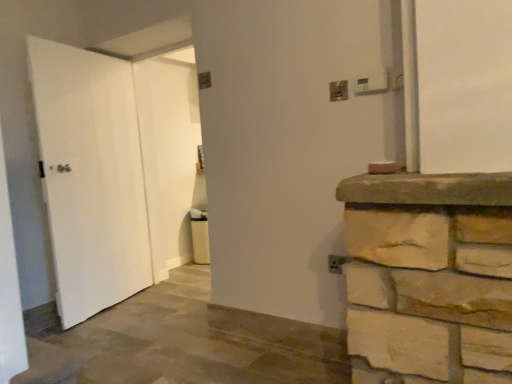
What do you see at coordinates (338, 90) in the screenshot?
I see `metallic silver electric outlet at upper center, which is counted as the second electric outlet, starting from the right` at bounding box center [338, 90].

Describe the element at coordinates (115, 170) in the screenshot. Image resolution: width=512 pixels, height=384 pixels. I see `white matte door at left, which is the 2th door from right to left` at that location.

At what (x,y) coordinates should I click in order to perform the action: click on metallic silver electric outlet at upper right, positioned as the first electric outlet in front-to-back order. Please return your answer as a coordinate pair (x, y). Looking at the image, I should click on (372, 83).

You are a GUI agent. You are given a task and a screenshot of the screen. Output one action in this format:
    pyautogui.click(x=<x>, y=<y>)
    Task: Click on the metallic silver electric outlet at upper center, which is counted as the second electric outlet, starting from the front
    The height and width of the screenshot is (384, 512).
    Given the screenshot: What is the action you would take?
    click(338, 90)

Find the location of a particular element. This screenshot has width=512, height=384. the 2nd door counting from the left of the metallic silver electric outlet at upper right, the second electric outlet when ordered from back to front is located at coordinates (115, 170).

Can you tell me how much metallic silver electric outlet at upper right, the 1th electric outlet viewed from the right, and white matte door at left, which is the 2th door from right to left, differ in facing direction?

101 degrees separate the facing orientations of metallic silver electric outlet at upper right, the 1th electric outlet viewed from the right, and white matte door at left, which is the 2th door from right to left.

From a real-world perspective, is metallic silver electric outlet at upper right, the second electric outlet when ordered from back to front, positioned above or below white matte door at left, which is the 2th door from right to left?

metallic silver electric outlet at upper right, the second electric outlet when ordered from back to front, is situated higher than white matte door at left, which is the 2th door from right to left, in the real world.

Considering the positions of objects white matte door at left, positioned as the 1th door in left-to-right order, and metallic silver electric outlet at upper right, the second electric outlet when ordered from back to front, in the image provided, who is more to the right, white matte door at left, positioned as the 1th door in left-to-right order, or metallic silver electric outlet at upper right, the second electric outlet when ordered from back to front,?

From the viewer's perspective, metallic silver electric outlet at upper right, the second electric outlet when ordered from back to front, appears more on the right side.

Locate an element on the screen. The height and width of the screenshot is (384, 512). the 1st door behind the metallic silver electric outlet at upper right, the 1th electric outlet viewed from the right, starting your count from the anchor is located at coordinates (115, 170).

Based on the photo, is white matte door at left, which is the 2th door from right to left, facing towards metallic silver electric outlet at upper right, the second electric outlet when ordered from back to front?

Yes.

Is white matte door at left, positioned as the 1th door in left-to-right order, taller than metallic silver electric outlet at upper right, positioned as the first electric outlet in front-to-back order?

Yes.

From a real-world perspective, which object rests below the other?

white matte door at left, positioned as the 1th door in left-to-right order, is physically lower.

Is white matte door at center, positioned as the second door in left-to-right order, oriented away from white matte door at left, positioned as the 1th door in left-to-right order?

Yes, white matte door at center, positioned as the second door in left-to-right order, is facing away from white matte door at left, positioned as the 1th door in left-to-right order.

From the image's perspective, is white matte door at center, positioned as the second door in left-to-right order, positioned above or below white matte door at left, which is the 2th door from right to left?

white matte door at center, positioned as the second door in left-to-right order, is above white matte door at left, which is the 2th door from right to left.

Which is more to the left, white matte door at center, the 1th door positioned from the right, or white matte door at left, positioned as the 1th door in left-to-right order?

Positioned to the left is white matte door at left, positioned as the 1th door in left-to-right order.

Find the location of `the 1st door counting from the left of the metallic silver electric outlet at upper center, which is counted as the second electric outlet, starting from the front`. the 1st door counting from the left of the metallic silver electric outlet at upper center, which is counted as the second electric outlet, starting from the front is located at coordinates (169, 157).

Based on the photo, is metallic silver electric outlet at upper center, which is counted as the second electric outlet, starting from the front, taller than white matte door at center, positioned as the second door in left-to-right order?

No, metallic silver electric outlet at upper center, which is counted as the second electric outlet, starting from the front, is not taller than white matte door at center, positioned as the second door in left-to-right order.

Which object is positioned more to the left, metallic silver electric outlet at upper center, which is counted as the second electric outlet, starting from the right, or white matte door at center, the 1th door positioned from the right?

From the viewer's perspective, white matte door at center, the 1th door positioned from the right, appears more on the left side.

Can you confirm if metallic silver electric outlet at upper center, which is counted as the second electric outlet, starting from the right, is bigger than white matte door at center, the 1th door positioned from the right?

Actually, metallic silver electric outlet at upper center, which is counted as the second electric outlet, starting from the right, might be smaller than white matte door at center, the 1th door positioned from the right.

In terms of width, does metallic silver electric outlet at upper right, positioned as the first electric outlet in front-to-back order, look wider or thinner when compared to metallic silver electric outlet at upper center, which is counted as the second electric outlet, starting from the front?

metallic silver electric outlet at upper right, positioned as the first electric outlet in front-to-back order, is wider than metallic silver electric outlet at upper center, which is counted as the second electric outlet, starting from the front.

Between metallic silver electric outlet at upper right, positioned as the first electric outlet in front-to-back order, and metallic silver electric outlet at upper center, which is counted as the 1th electric outlet, starting from the left, which one has larger size?

metallic silver electric outlet at upper right, positioned as the first electric outlet in front-to-back order.

From the image's perspective, is metallic silver electric outlet at upper right, the second electric outlet when ordered from back to front, beneath metallic silver electric outlet at upper center, which is counted as the 1th electric outlet, starting from the left?

No, from the image's perspective, metallic silver electric outlet at upper right, the second electric outlet when ordered from back to front, is not below metallic silver electric outlet at upper center, which is counted as the 1th electric outlet, starting from the left.

Is the position of white matte door at left, positioned as the 1th door in left-to-right order, less distant than that of metallic silver electric outlet at upper center, the first electric outlet from the back?

No, white matte door at left, positioned as the 1th door in left-to-right order, is further to the viewer.

Between white matte door at left, which is the 2th door from right to left, and metallic silver electric outlet at upper center, the first electric outlet from the back, which one has larger size?

white matte door at left, which is the 2th door from right to left.

Is point (169, 144) closer or farther from the camera than point (343, 100)?

Point (169, 144) is positioned farther from the camera compared to point (343, 100).

Which of these two, metallic silver electric outlet at upper right, the second electric outlet when ordered from back to front, or white matte door at center, positioned as the second door in left-to-right order, stands taller?

With more height is white matte door at center, positioned as the second door in left-to-right order.

Between metallic silver electric outlet at upper right, positioned as the first electric outlet in front-to-back order, and white matte door at center, the 1th door positioned from the right, which one has smaller width?

With smaller width is metallic silver electric outlet at upper right, positioned as the first electric outlet in front-to-back order.

Measure the distance between metallic silver electric outlet at upper right, acting as the second electric outlet starting from the left, and white matte door at center, positioned as the second door in left-to-right order.

metallic silver electric outlet at upper right, acting as the second electric outlet starting from the left, is 2.46 meters from white matte door at center, positioned as the second door in left-to-right order.

From a real-world perspective, who is located higher, metallic silver electric outlet at upper right, positioned as the first electric outlet in front-to-back order, or white matte door at center, the 1th door positioned from the right?

From a 3D spatial view, metallic silver electric outlet at upper right, positioned as the first electric outlet in front-to-back order, is above.

Where is `door that is the 2nd object directly below the metallic silver electric outlet at upper right, positioned as the first electric outlet in front-to-back order (from a real-world perspective)`? This screenshot has height=384, width=512. door that is the 2nd object directly below the metallic silver electric outlet at upper right, positioned as the first electric outlet in front-to-back order (from a real-world perspective) is located at coordinates (115, 170).

From the image's perspective, count 2nd electric outlets upward from the white matte door at left, positioned as the 1th door in left-to-right order, and point to it. Please provide its 2D coordinates.

[(372, 83)]

Looking at the image, which one is located further to white matte door at center, positioned as the second door in left-to-right order, white matte door at left, positioned as the 1th door in left-to-right order, or metallic silver electric outlet at upper center, which is counted as the second electric outlet, starting from the front?

The object further to white matte door at center, positioned as the second door in left-to-right order, is metallic silver electric outlet at upper center, which is counted as the second electric outlet, starting from the front.

Based on their spatial positions, is white matte door at center, the 1th door positioned from the right, or metallic silver electric outlet at upper center, the first electric outlet from the back, closer to metallic silver electric outlet at upper right, the second electric outlet when ordered from back to front?

metallic silver electric outlet at upper center, the first electric outlet from the back, is closer to metallic silver electric outlet at upper right, the second electric outlet when ordered from back to front.

In the scene shown: When comparing their distances from white matte door at left, which is the 2th door from right to left, does metallic silver electric outlet at upper right, acting as the second electric outlet starting from the left, or metallic silver electric outlet at upper center, which is counted as the 1th electric outlet, starting from the left, seem closer?

Among the two, metallic silver electric outlet at upper center, which is counted as the 1th electric outlet, starting from the left, is located nearer to white matte door at left, which is the 2th door from right to left.

Consider the image. Based on their spatial positions, is white matte door at left, which is the 2th door from right to left, or metallic silver electric outlet at upper right, positioned as the first electric outlet in front-to-back order, closer to white matte door at center, positioned as the second door in left-to-right order?

white matte door at left, which is the 2th door from right to left, is positioned closer to the anchor white matte door at center, positioned as the second door in left-to-right order.

Estimate the real-world distances between objects in this image. Which object is closer to metallic silver electric outlet at upper right, the second electric outlet when ordered from back to front, metallic silver electric outlet at upper center, which is counted as the 1th electric outlet, starting from the left, or white matte door at center, positioned as the second door in left-to-right order?

metallic silver electric outlet at upper center, which is counted as the 1th electric outlet, starting from the left, is closer to metallic silver electric outlet at upper right, the second electric outlet when ordered from back to front.

From the image, which object appears to be farther from metallic silver electric outlet at upper center, which is counted as the second electric outlet, starting from the front, metallic silver electric outlet at upper right, positioned as the first electric outlet in front-to-back order, or white matte door at center, the 1th door positioned from the right?

white matte door at center, the 1th door positioned from the right.

When comparing their distances from white matte door at center, the 1th door positioned from the right, does metallic silver electric outlet at upper right, acting as the second electric outlet starting from the left, or white matte door at left, positioned as the 1th door in left-to-right order, seem closer?

white matte door at left, positioned as the 1th door in left-to-right order, is positioned closer to the anchor white matte door at center, the 1th door positioned from the right.

Based on the photo, when comparing their distances from white matte door at left, positioned as the 1th door in left-to-right order, does metallic silver electric outlet at upper center, which is counted as the second electric outlet, starting from the right, or metallic silver electric outlet at upper right, acting as the second electric outlet starting from the left, seem further?

metallic silver electric outlet at upper right, acting as the second electric outlet starting from the left.

Find the location of a particular element. This screenshot has width=512, height=384. door located between white matte door at left, positioned as the 1th door in left-to-right order, and metallic silver electric outlet at upper center, the first electric outlet from the back, in the left-right direction is located at coordinates (169, 157).

I want to click on electric outlet between white matte door at left, positioned as the 1th door in left-to-right order, and metallic silver electric outlet at upper right, the second electric outlet when ordered from back to front, in the horizontal direction, so click(338, 90).

Locate an element on the screen. This screenshot has height=384, width=512. electric outlet between white matte door at center, the 1th door positioned from the right, and metallic silver electric outlet at upper right, positioned as the first electric outlet in front-to-back order is located at coordinates (338, 90).

This screenshot has height=384, width=512. I want to click on door between white matte door at left, which is the 2th door from right to left, and metallic silver electric outlet at upper right, acting as the second electric outlet starting from the left, in the horizontal direction, so click(x=169, y=157).